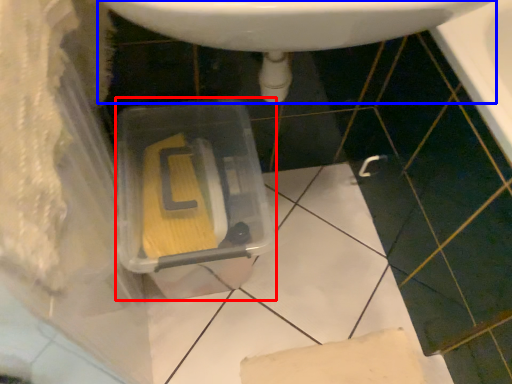
Question: Which of the following is the farthest to the observer, storage box (highlighted by a red box) or sink (highlighted by a blue box)?

Choices:
 (A) storage box
 (B) sink

Answer: (A)